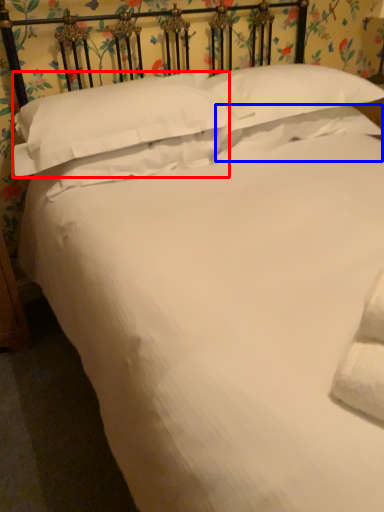
Question: Which object appears farthest to the camera in this image, pillow (highlighted by a red box) or pillow (highlighted by a blue box)?

Choices:
 (A) pillow
 (B) pillow

Answer: (B)